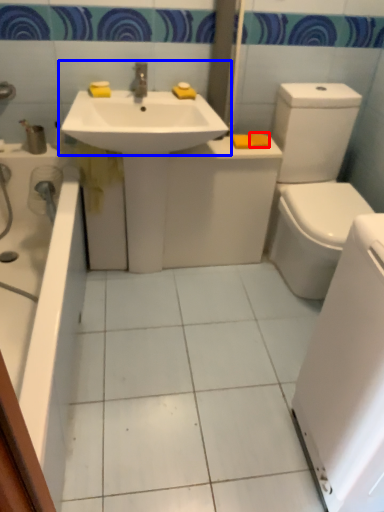
Question: Which point is further to the camera, soap (highlighted by a red box) or sink (highlighted by a blue box)?

Choices:
 (A) soap
 (B) sink

Answer: (A)